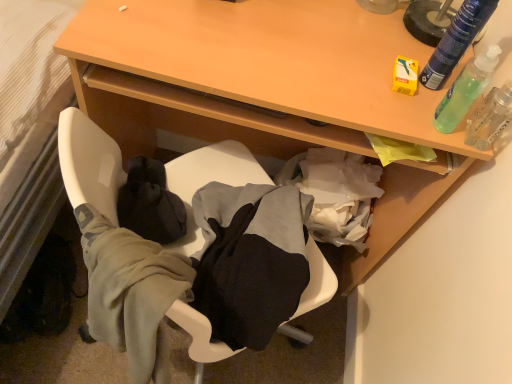
Locate an element on the screen. The image size is (512, 384). vacant space that is in between green translucent bottle at upper right, which appears as the 2th bottle when ordered from the bottom, and clear plastic spray bottle at upper right is located at coordinates (453, 106).